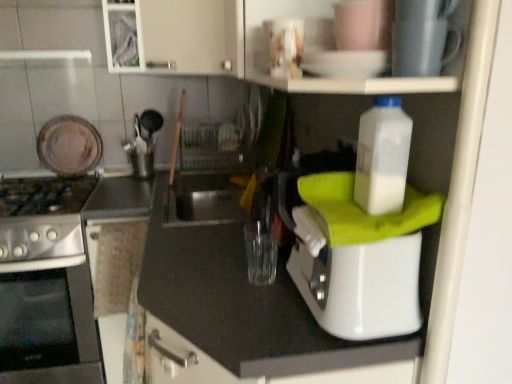
Question: Considering the positions of white matte cabinet at upper center and white plastic bottle at upper right in the image, is white matte cabinet at upper center bigger or smaller than white plastic bottle at upper right?

Choices:
 (A) small
 (B) big

Answer: (B)

Question: Considering their positions, is white matte cabinet at upper center located in front of or behind white plastic bottle at upper right?

Choices:
 (A) front
 (B) behind

Answer: (B)

Question: Estimate the real-world distances between objects in this image. Which object is farther from the satin silver gas stove at left?

Choices:
 (A) matte brown plate at upper left, positioned as the first appliance in left-to-right order
 (B) metallic silver cup at upper center, the 2th appliance from the left
 (C) white plastic bottle at upper right
 (D) white matte cabinet at upper center
 (E) stainless steel oven at left

Answer: (B)

Question: Which object is positioned closest to the matte brown plate at upper left, acting as the second appliance starting from the front?

Choices:
 (A) white matte cabinet at upper center
 (B) metallic silver cup at upper center, which appears as the 1th appliance when viewed from the right
 (C) white plastic bottle at upper right
 (D) stainless steel oven at left
 (E) satin silver gas stove at left

Answer: (E)